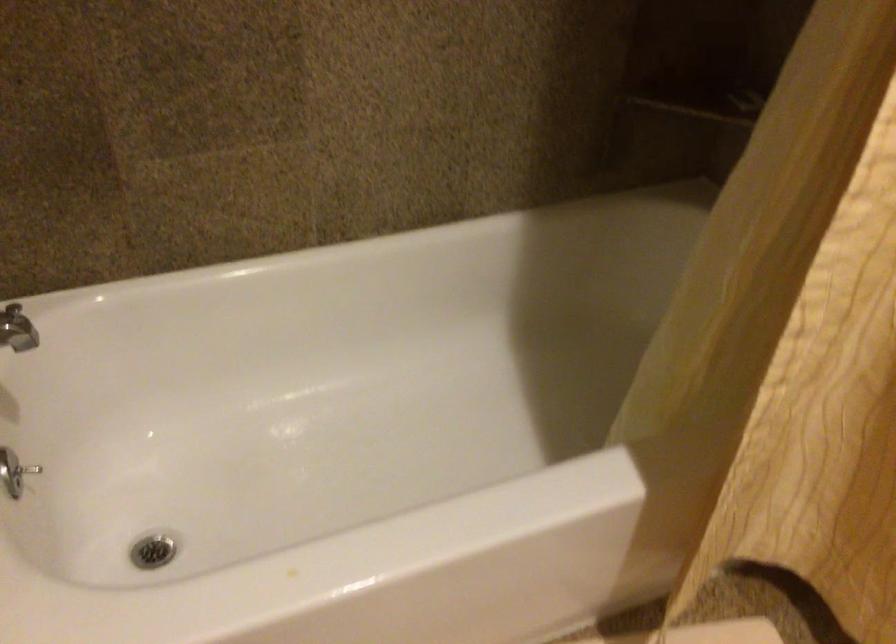
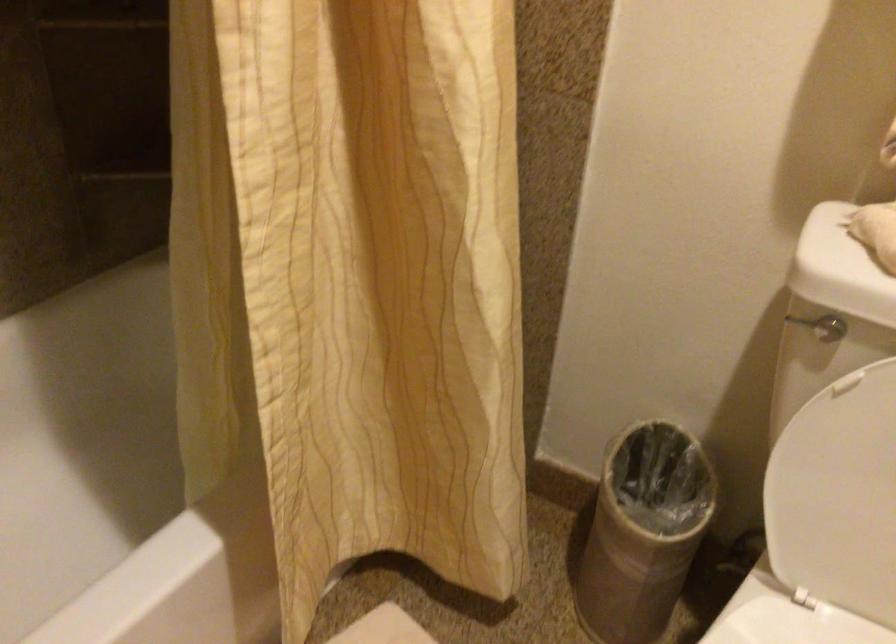
Question: Based on the continuous images, in which direction is the camera rotating? Reply with the corresponding letter.

Choices:
 (A) Left
 (B) Right
 (C) Up
 (D) Down

Answer: (B)